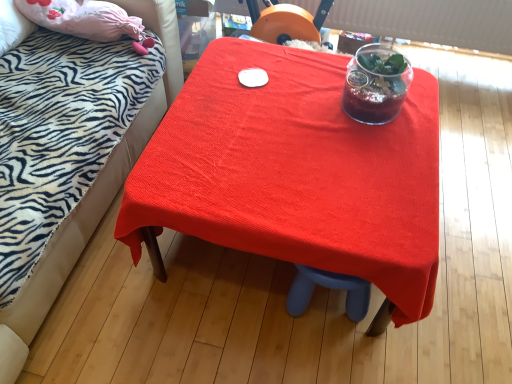
Identify the location of free space in front of translucent glass vase at upper center. The width and height of the screenshot is (512, 384). (374, 145).